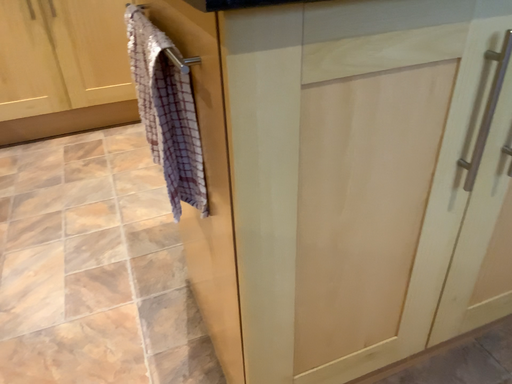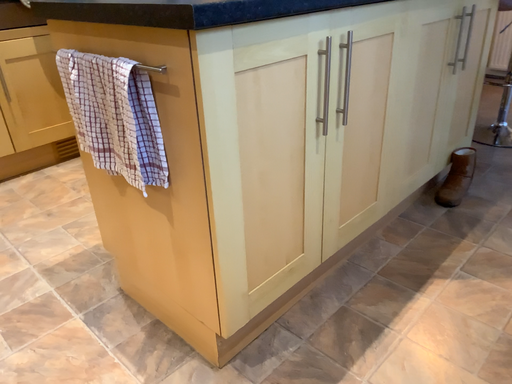
Question: Which way did the camera rotate in the video?

Choices:
 (A) rotated downward
 (B) rotated upward

Answer: (B)